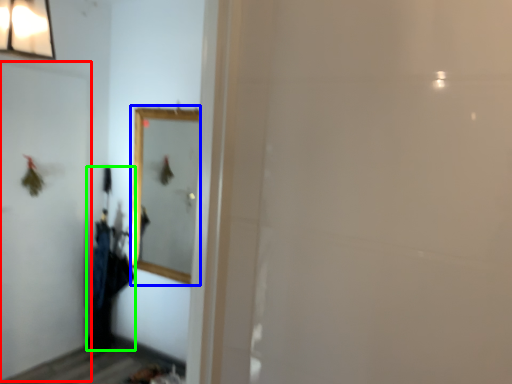
Question: Which is farther away from screen door (highlighted by a red box)? mirror (highlighted by a blue box) or laundry (highlighted by a green box)?

Choices:
 (A) mirror
 (B) laundry

Answer: (A)